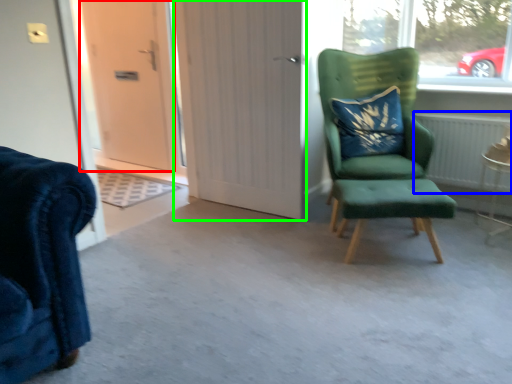
Question: Estimate the real-world distances between objects in this image. Which object is farther from door (highlighted by a red box), radiator (highlighted by a blue box) or door (highlighted by a green box)?

Choices:
 (A) radiator
 (B) door

Answer: (A)